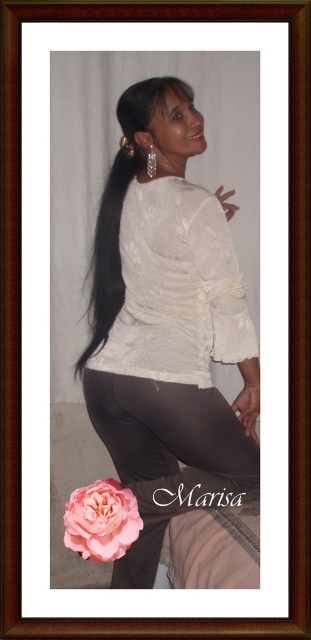
Question: Which of the following is the closest to the observer?

Choices:
 (A) matte black leggings at lower center
 (B) pink matte rose at lower left
 (C) black silky hair at center
 (D) white lace blouse at center

Answer: (B)

Question: Which object appears closest to the camera in this image?

Choices:
 (A) black silky hair at center
 (B) pink matte rose at lower left

Answer: (B)

Question: Is white lace blouse at center to the right of matte black leggings at lower center from the viewer's perspective?

Choices:
 (A) no
 (B) yes

Answer: (A)

Question: Is white lace blouse at center above black silky hair at center?

Choices:
 (A) yes
 (B) no

Answer: (B)

Question: Which object is the farthest from the matte black leggings at lower center?

Choices:
 (A) white lace blouse at center
 (B) pink matte rose at lower left
 (C) black silky hair at center

Answer: (C)

Question: Can you confirm if white lace blouse at center is positioned to the right of black silky hair at center?

Choices:
 (A) yes
 (B) no

Answer: (A)